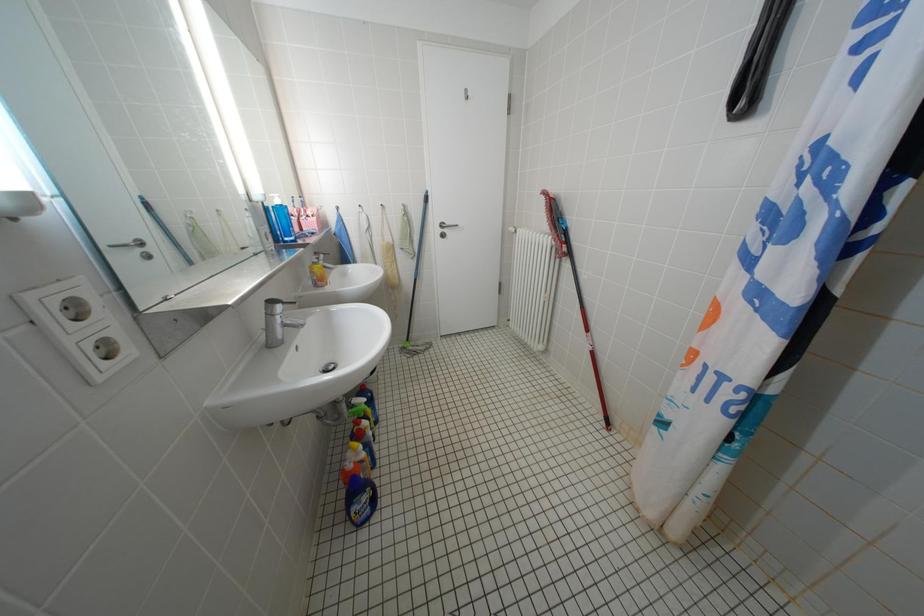
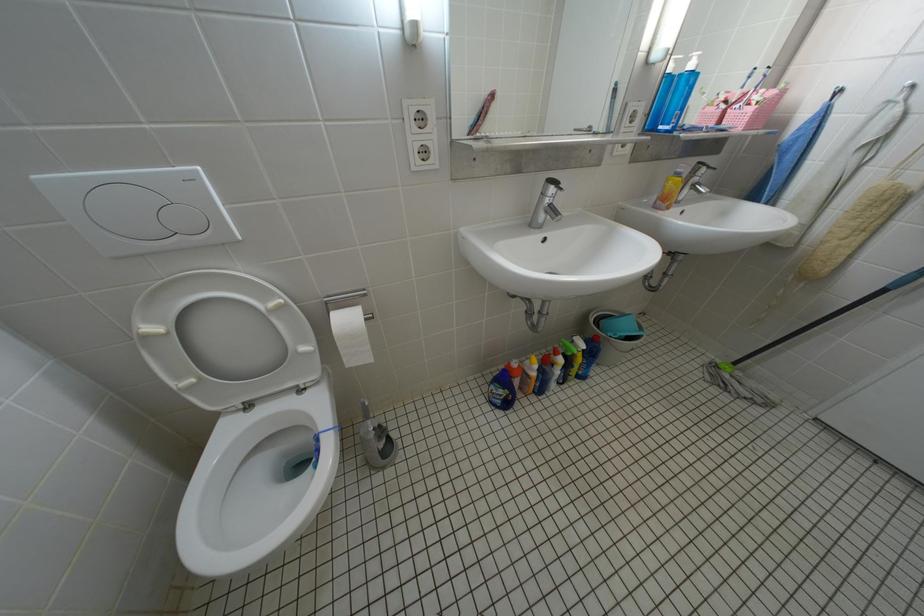
Based on the continuous images, in which direction is the camera rotating?

The rotation direction of the camera is left-down.